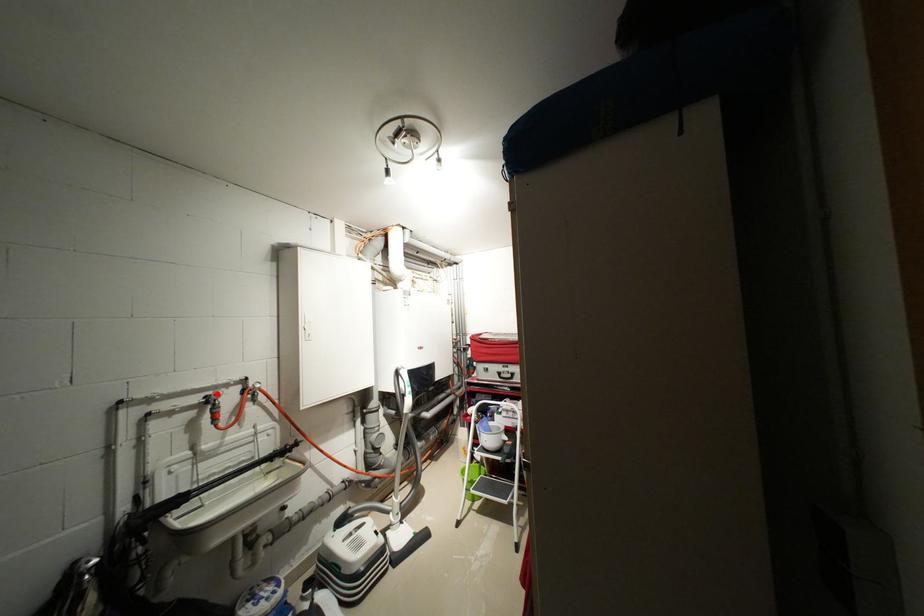
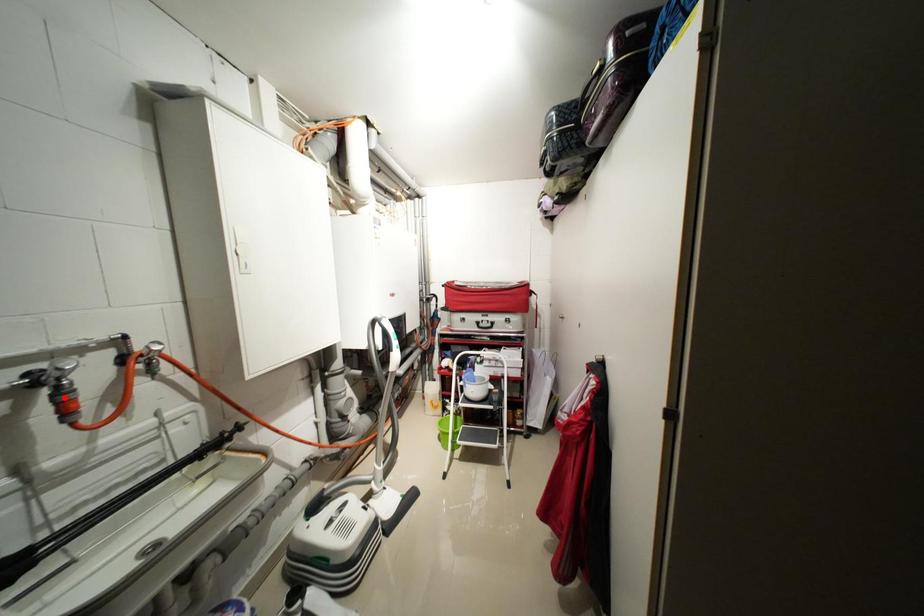
I am providing you with two images of the same scene from different viewpoints. A red point is marked on the first image and another point is marked on the second image. Does the point marked in image1 correspond to the same location as the one in image2?

No